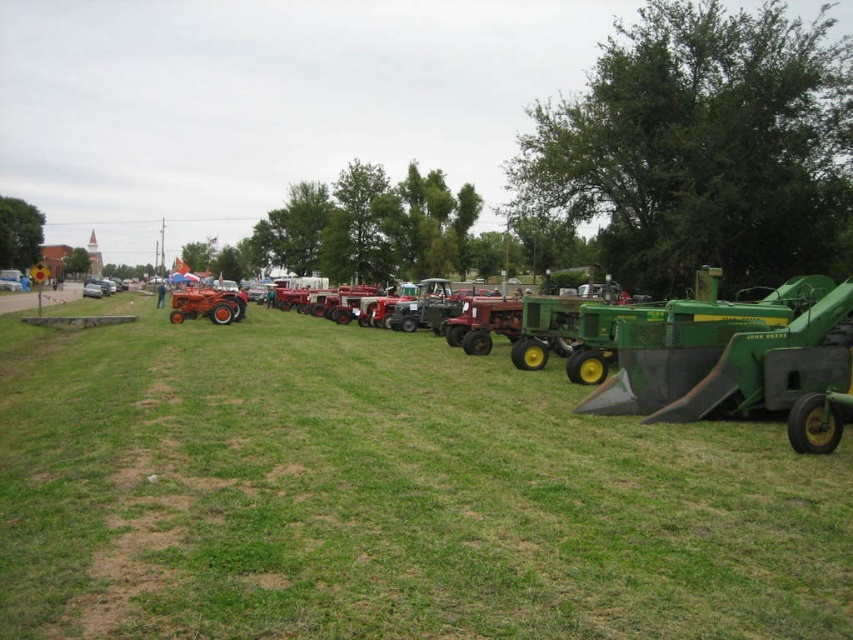
What do you see at coordinates (386, 497) in the screenshot? I see `green grassy field at center` at bounding box center [386, 497].

Is point (137, 422) behind point (230, 304)?

No.

The height and width of the screenshot is (640, 853). I want to click on green grassy field at center, so click(x=386, y=497).

Locate an element on the screen. The height and width of the screenshot is (640, 853). green grassy field at center is located at coordinates (386, 497).

Which is more to the left, green grassy field at center or green matte tractor at right?

Positioned to the left is green grassy field at center.

Is point (491, 397) positioned behind point (767, 336)?

Yes.

The image size is (853, 640). Find the location of `green grassy field at center`. green grassy field at center is located at coordinates (386, 497).

Consider the image. Who is positioned more to the left, green matte tractor at right or matte red tractor at center?

matte red tractor at center is more to the left.

This screenshot has height=640, width=853. What do you see at coordinates (741, 362) in the screenshot?
I see `green matte tractor at right` at bounding box center [741, 362].

You are a GUI agent. You are given a task and a screenshot of the screen. Output one action in this format:
    pyautogui.click(x=<x>, y=<y>)
    Task: Click on the green matte tractor at right
    The width and height of the screenshot is (853, 640).
    Given the screenshot: What is the action you would take?
    pyautogui.click(x=741, y=362)